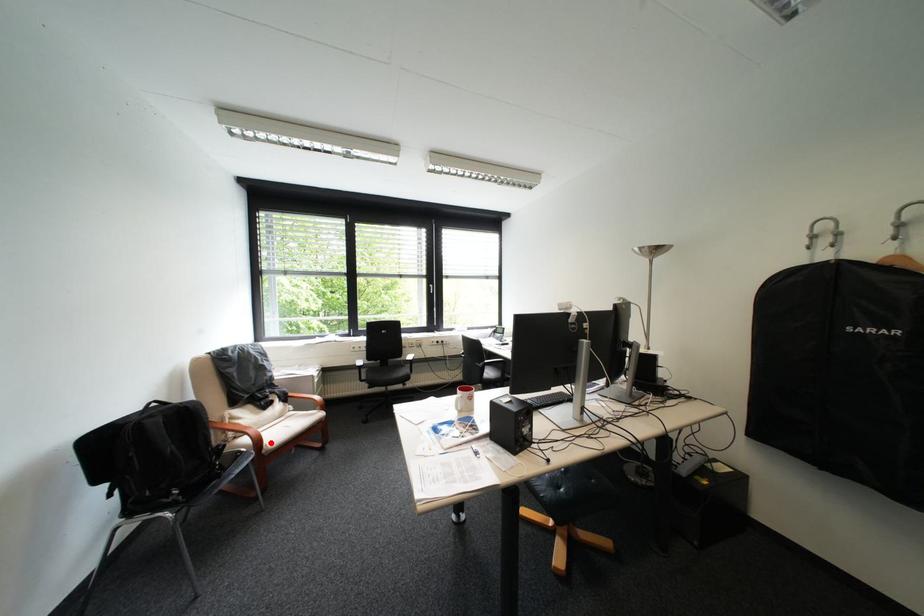
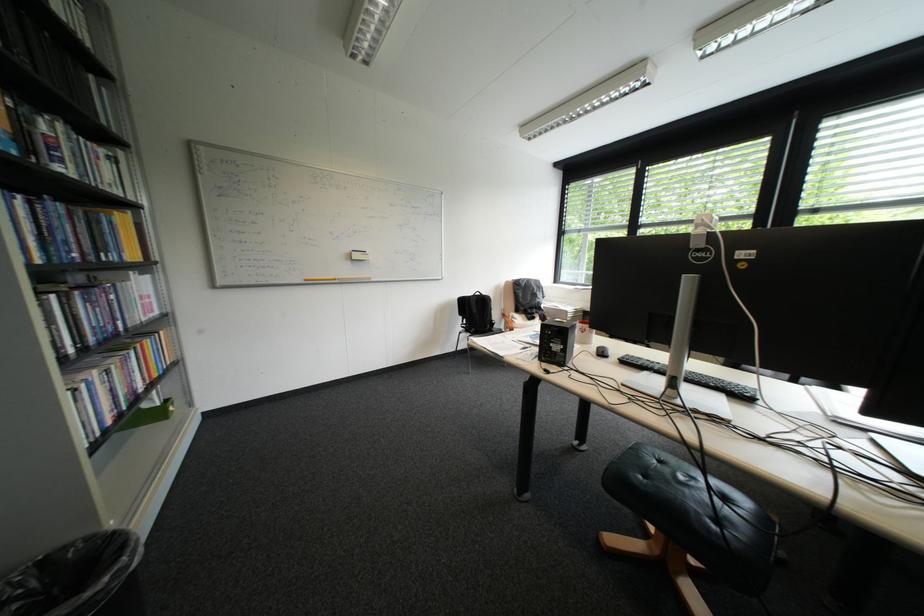
Question: I am providing you with two images of the same scene from different viewpoints. A red point is marked on the first image. Is the red point's position out of view in image 2?

Choices:
 (A) Yes
 (B) No

Answer: (A)